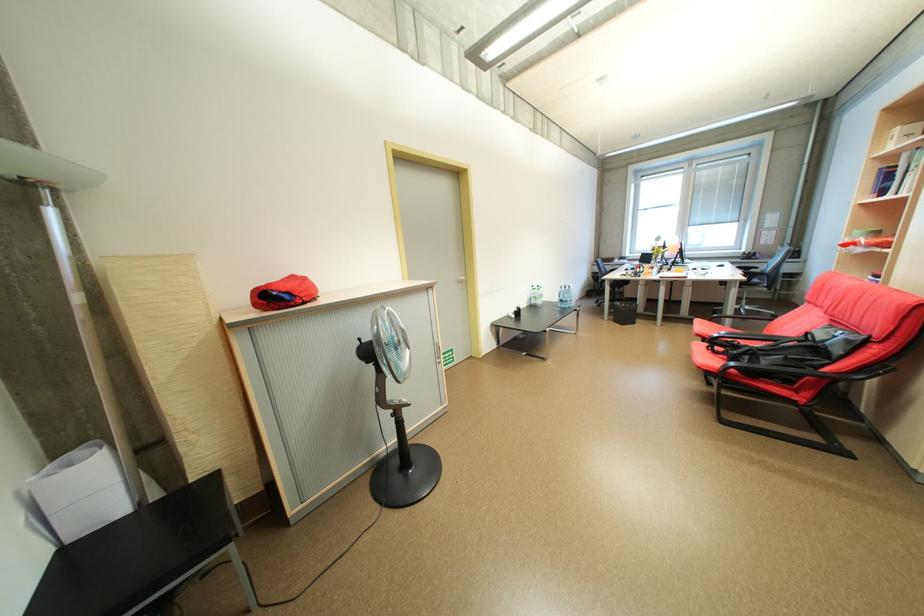
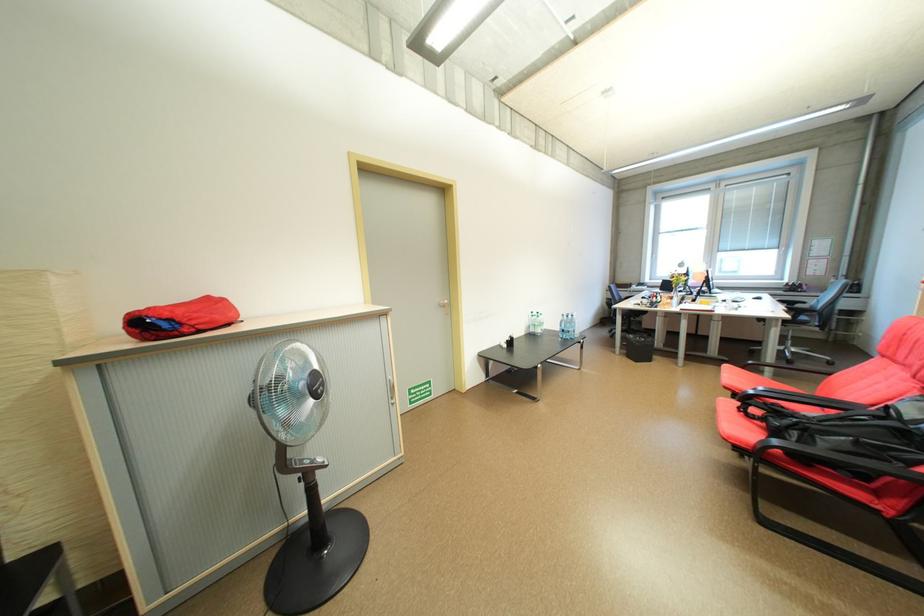
In the second image, find the point that corresponds to [565,300] in the first image.

(566, 329)